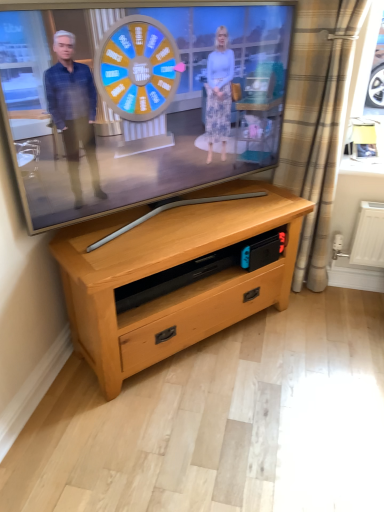
Question: Considering the relative sizes of light wood chest of drawers at center and matte wooden tv at center in the image provided, is light wood chest of drawers at center wider than matte wooden tv at center?

Choices:
 (A) no
 (B) yes

Answer: (B)

Question: Considering the relative positions of light wood chest of drawers at center and matte wooden tv at center in the image provided, is light wood chest of drawers at center behind matte wooden tv at center?

Choices:
 (A) no
 (B) yes

Answer: (B)

Question: Is light wood chest of drawers at center facing towards matte wooden tv at center?

Choices:
 (A) no
 (B) yes

Answer: (A)

Question: From a real-world perspective, does light wood chest of drawers at center sit lower than matte wooden tv at center?

Choices:
 (A) no
 (B) yes

Answer: (B)

Question: Are light wood chest of drawers at center and matte wooden tv at center beside each other?

Choices:
 (A) no
 (B) yes

Answer: (A)

Question: Is there a large distance between light wood chest of drawers at center and matte wooden tv at center?

Choices:
 (A) no
 (B) yes

Answer: (A)

Question: Is matte wooden tv at center positioned before beige plaid curtain at right?

Choices:
 (A) yes
 (B) no

Answer: (A)

Question: Can you see matte wooden tv at center touching beige plaid curtain at right?

Choices:
 (A) no
 (B) yes

Answer: (A)

Question: Does matte wooden tv at center have a lesser height compared to beige plaid curtain at right?

Choices:
 (A) no
 (B) yes

Answer: (B)

Question: From the image's perspective, is matte wooden tv at center above beige plaid curtain at right?

Choices:
 (A) yes
 (B) no

Answer: (A)

Question: Considering the relative sizes of matte wooden tv at center and beige plaid curtain at right in the image provided, is matte wooden tv at center bigger than beige plaid curtain at right?

Choices:
 (A) no
 (B) yes

Answer: (B)

Question: Is there a large distance between matte wooden tv at center and beige plaid curtain at right?

Choices:
 (A) no
 (B) yes

Answer: (A)

Question: Does beige plaid curtain at right have a greater height compared to matte wooden tv at center?

Choices:
 (A) yes
 (B) no

Answer: (A)